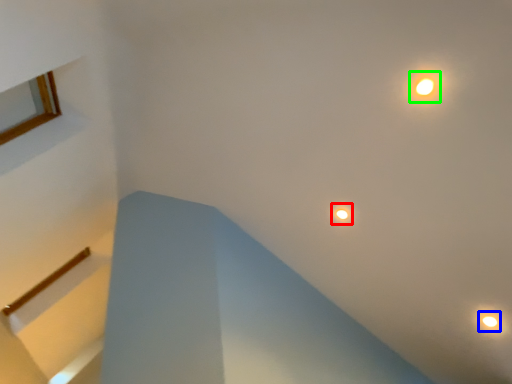
Question: Based on their relative distances, which object is farther from droplight (highlighted by a red box)? Choose from droplight (highlighted by a blue box) and light (highlighted by a green box).

Choices:
 (A) droplight
 (B) light

Answer: (A)